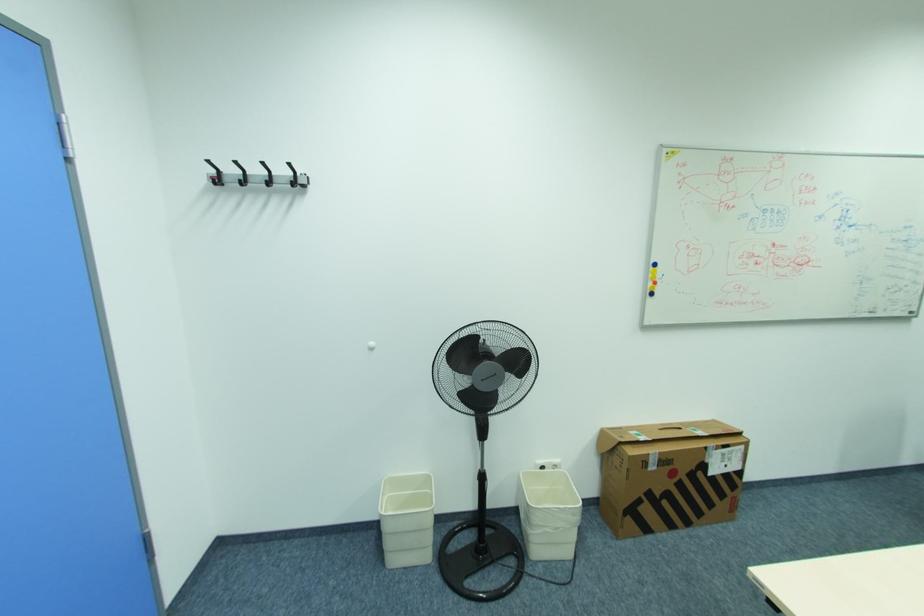
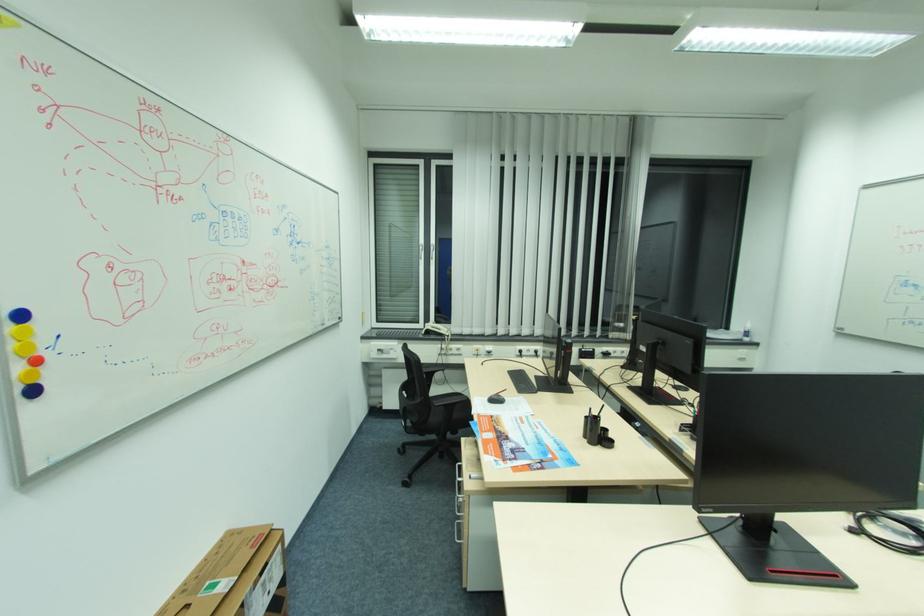
Question: The camera is either moving clockwise (left) or counter-clockwise (right) around the object. The first image is from the beginning of the video and the second image is from the end. Is the camera moving left or right when shooting the video?

Choices:
 (A) Left
 (B) Right

Answer: (A)